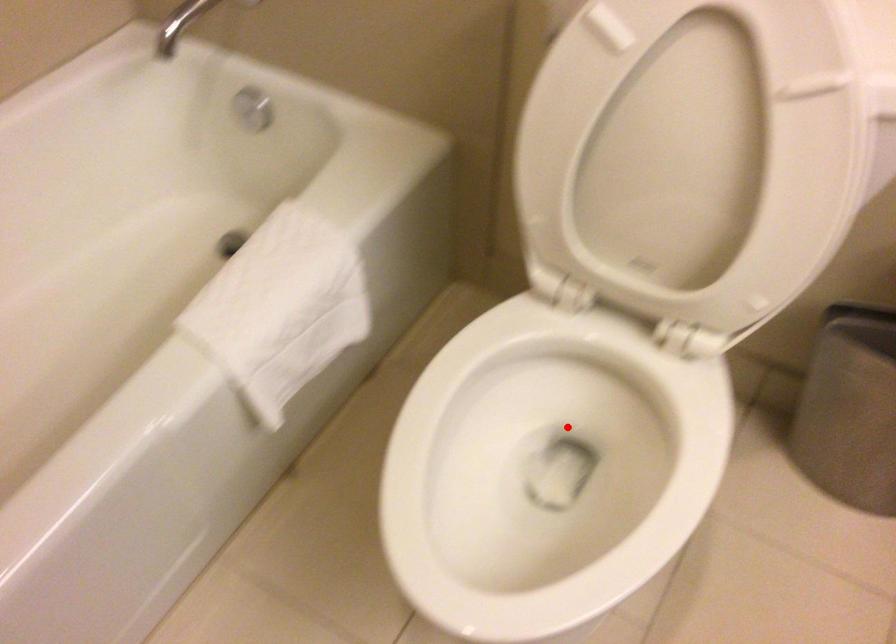
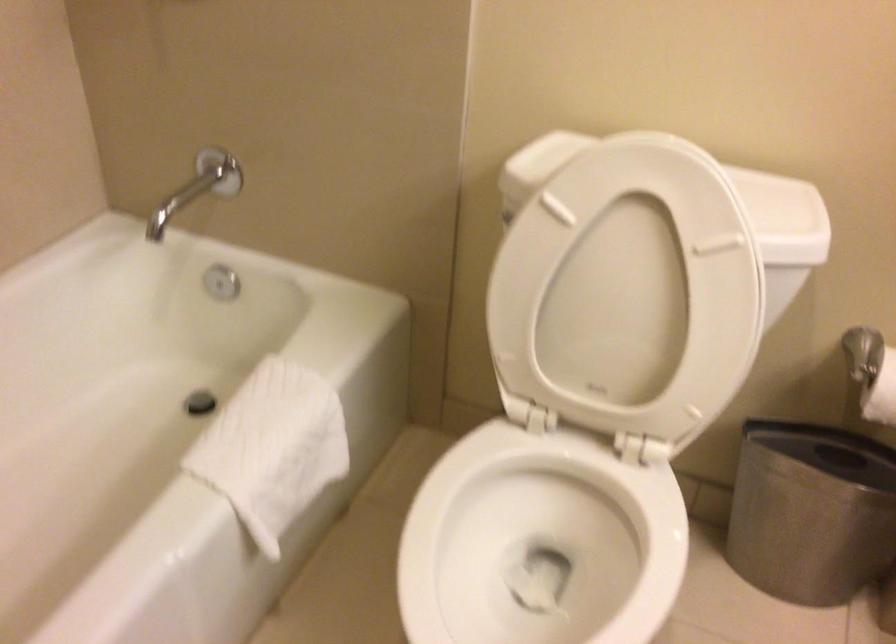
Locate, in the second image, the point that corresponds to the highlighted location in the first image.

(539, 542)